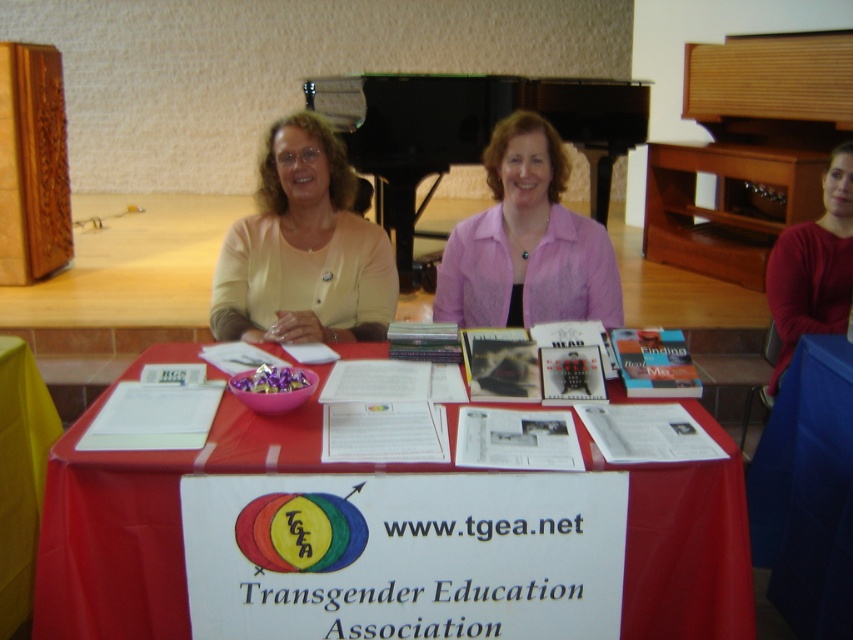
You are organizing a clothing donation drive and need to determine which item takes up more space. Based on the scene, which object between the matte yellow sweater at center and the red matte shirt at upper right occupies more area?

The matte yellow sweater at center is larger in size than the red matte shirt at upper right, so it occupies more area.

You are a visitor at the community event booth. You want to pick up both the pink sheer blouse at center and the yellow fabric at lower left. If you can only carry one item at a time, which item should you pick up first to minimize the total distance walked?

You should pick up the pink sheer blouse at center first since it is closer to the center of the table, and then walk to the yellow fabric at lower left, resulting in a shorter total distance compared to starting with the yellow fabric at lower left.